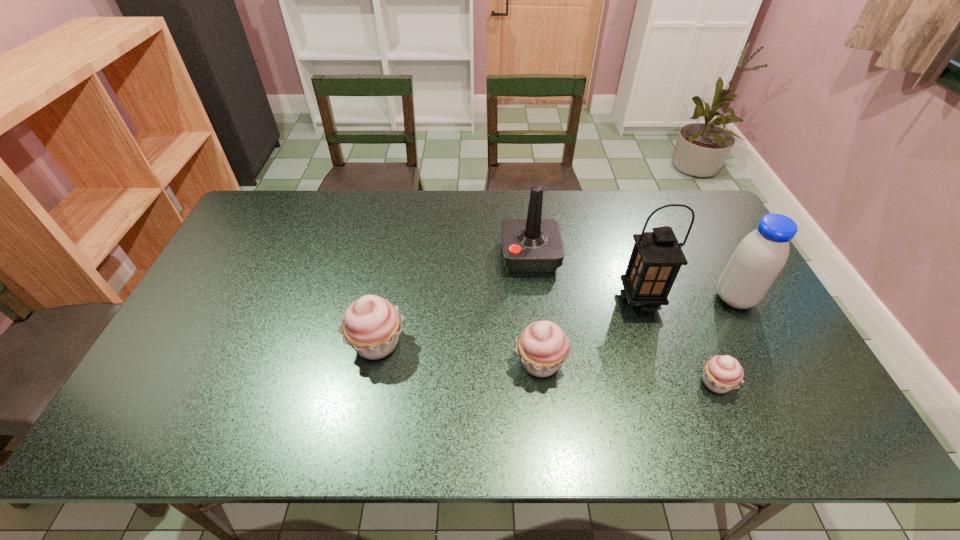
Please point a spot to add another cupcake on the left. Please provide its 2D coordinates. Your answer should be formatted as a tuple, i.e. [(x, y)], where the tuple contains the x and y coordinates of a point satisfying the conditions above.

[(225, 326)]